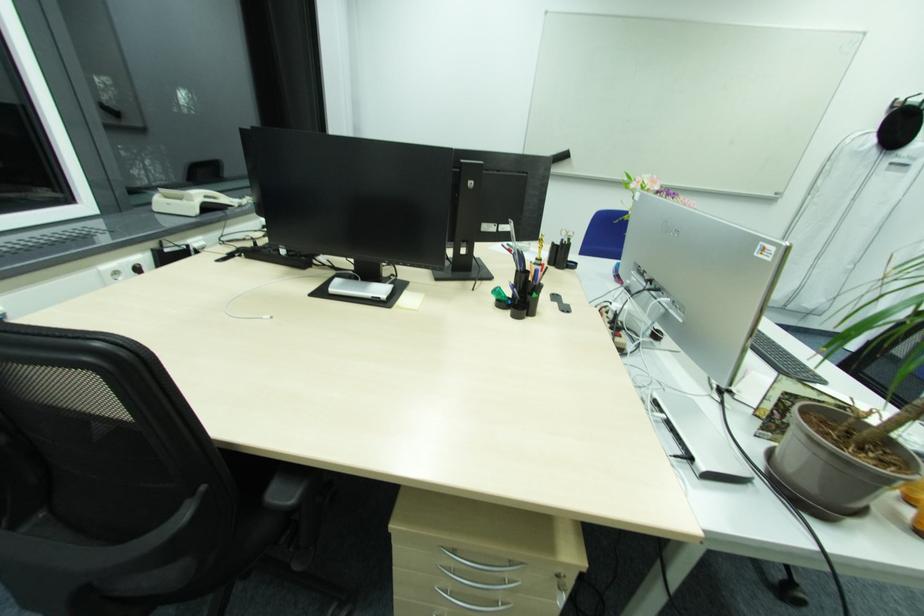
What do you see at coordinates (285, 492) in the screenshot?
I see `a black chair armrest` at bounding box center [285, 492].